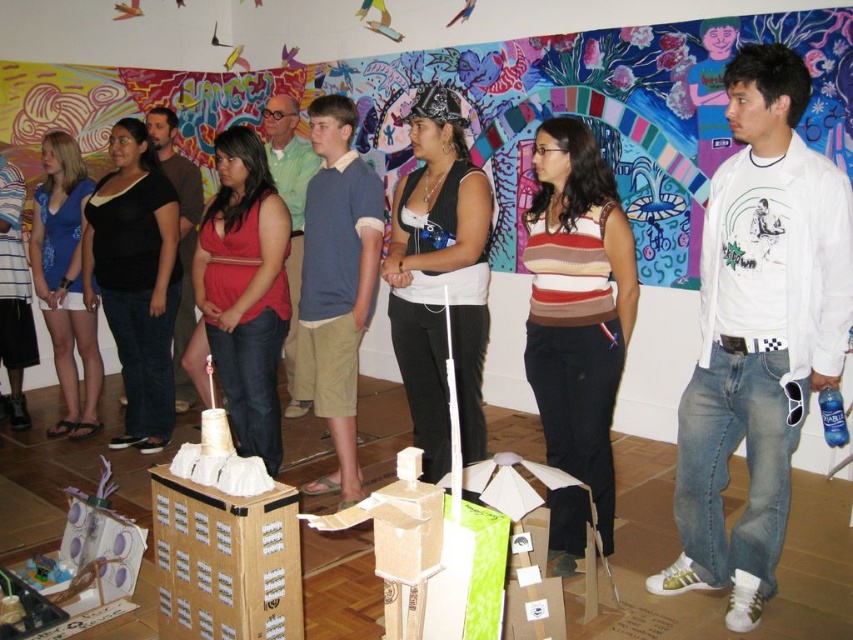
How far apart are blue cotton shirt at center and black cotton shirt at center?

blue cotton shirt at center is 25.67 inches from black cotton shirt at center.

What are the coordinates of `blue cotton shirt at center` in the screenshot? It's located at [289, 211].

Locate an element on the screen. The image size is (853, 640). blue cotton shirt at center is located at coordinates (289, 211).